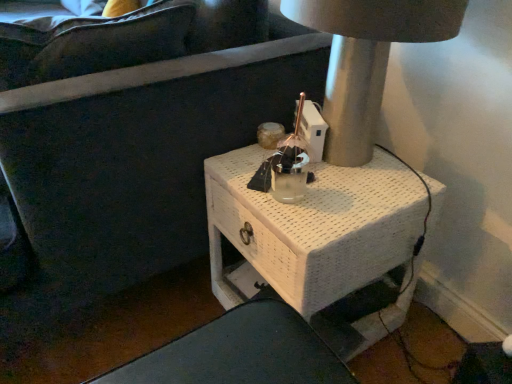
At what (x,y) coordinates should I click in order to perform the action: click on vacant area on top of white woven table at center (from a real-world perspective). Please return your answer as a coordinate pair (x, y). This screenshot has height=384, width=512. Looking at the image, I should click on (330, 180).